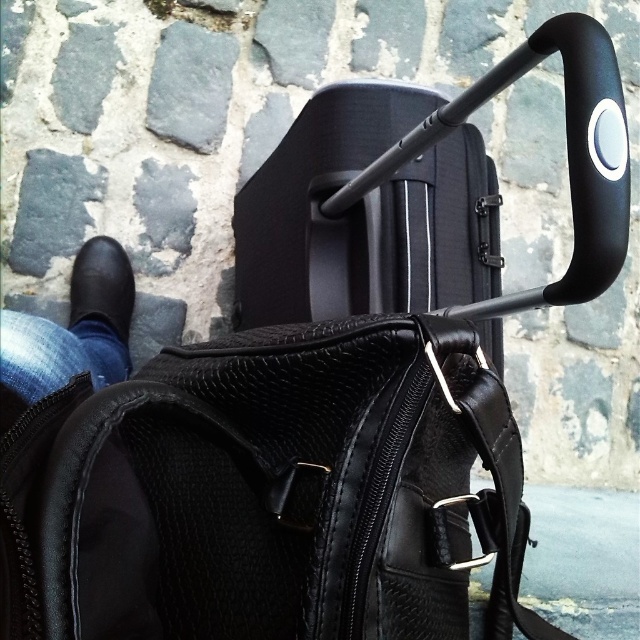
Question: Which object is closer to the camera taking this photo?

Choices:
 (A) black leather shoe at lower left
 (B) black leather bag at center
 (C) matte black suitcase at upper center

Answer: (B)

Question: Is black leather bag at center to the left of matte black suitcase at upper center from the viewer's perspective?

Choices:
 (A) yes
 (B) no

Answer: (A)

Question: Does black leather bag at center have a lesser width compared to black leather shoe at lower left?

Choices:
 (A) no
 (B) yes

Answer: (A)

Question: Which point is closer to the camera?

Choices:
 (A) matte black suitcase at upper center
 (B) black leather bag at center
 (C) black leather shoe at lower left

Answer: (B)

Question: Which object is the farthest from the matte black suitcase at upper center?

Choices:
 (A) black leather shoe at lower left
 (B) black leather bag at center

Answer: (A)

Question: Can you confirm if black leather bag at center is positioned to the right of matte black suitcase at upper center?

Choices:
 (A) no
 (B) yes

Answer: (A)